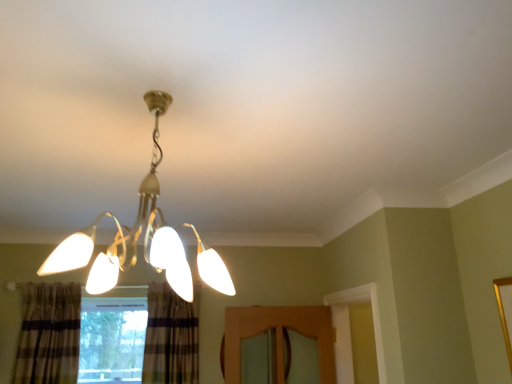
Question: Does plaid fabric curtain at lower center, which is the first curtain from right to left, have a lesser width compared to clear glass window at lower left?

Choices:
 (A) no
 (B) yes

Answer: (A)

Question: Does plaid fabric curtain at lower center, which is the first curtain from right to left, have a lesser height compared to clear glass window at lower left?

Choices:
 (A) no
 (B) yes

Answer: (A)

Question: Is plaid fabric curtain at lower center, which is the first curtain from right to left, wider than clear glass window at lower left?

Choices:
 (A) no
 (B) yes

Answer: (B)

Question: Is plaid fabric curtain at lower center, the 2th curtain positioned from the left, completely or partially outside of clear glass window at lower left?

Choices:
 (A) yes
 (B) no

Answer: (A)

Question: Does plaid fabric curtain at lower center, the 2th curtain positioned from the left, appear on the right side of clear glass window at lower left?

Choices:
 (A) no
 (B) yes

Answer: (B)

Question: Is plaid fabric curtain at lower center, the 2th curtain positioned from the left, facing away from clear glass window at lower left?

Choices:
 (A) yes
 (B) no

Answer: (B)

Question: From the image's perspective, is clear glass window at lower left under matte gold chandelier at center?

Choices:
 (A) yes
 (B) no

Answer: (A)

Question: Is clear glass window at lower left taller than matte gold chandelier at center?

Choices:
 (A) yes
 (B) no

Answer: (A)

Question: Considering the relative sizes of clear glass window at lower left and matte gold chandelier at center in the image provided, is clear glass window at lower left thinner than matte gold chandelier at center?

Choices:
 (A) yes
 (B) no

Answer: (A)

Question: Does clear glass window at lower left have a lesser height compared to matte gold chandelier at center?

Choices:
 (A) yes
 (B) no

Answer: (B)

Question: From the image's perspective, is clear glass window at lower left on matte gold chandelier at center?

Choices:
 (A) no
 (B) yes

Answer: (A)

Question: From a real-world perspective, is clear glass window at lower left on top of matte gold chandelier at center?

Choices:
 (A) yes
 (B) no

Answer: (B)

Question: Can you confirm if matte gold chandelier at center is positioned to the left of plaid fabric curtain at lower center, which is the first curtain from right to left?

Choices:
 (A) no
 (B) yes

Answer: (A)